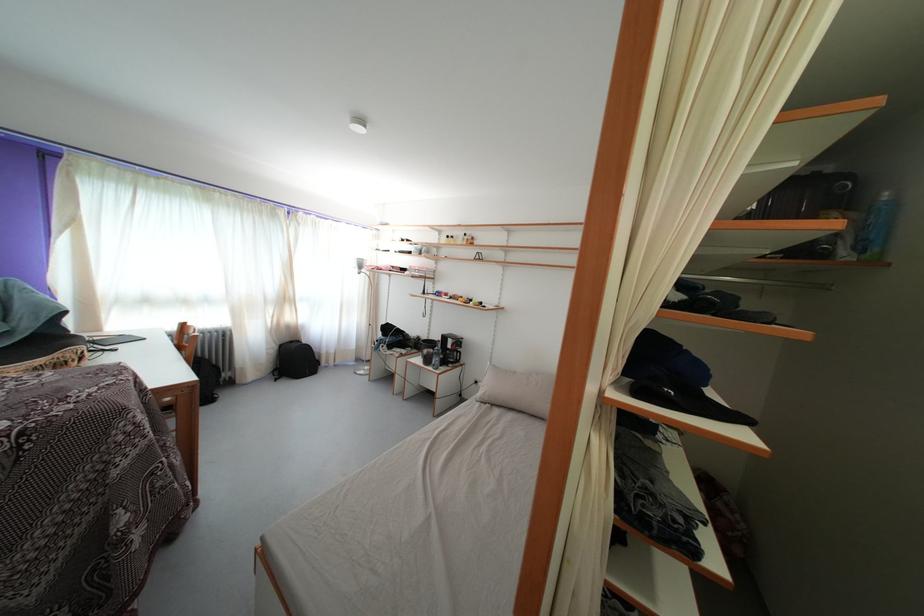
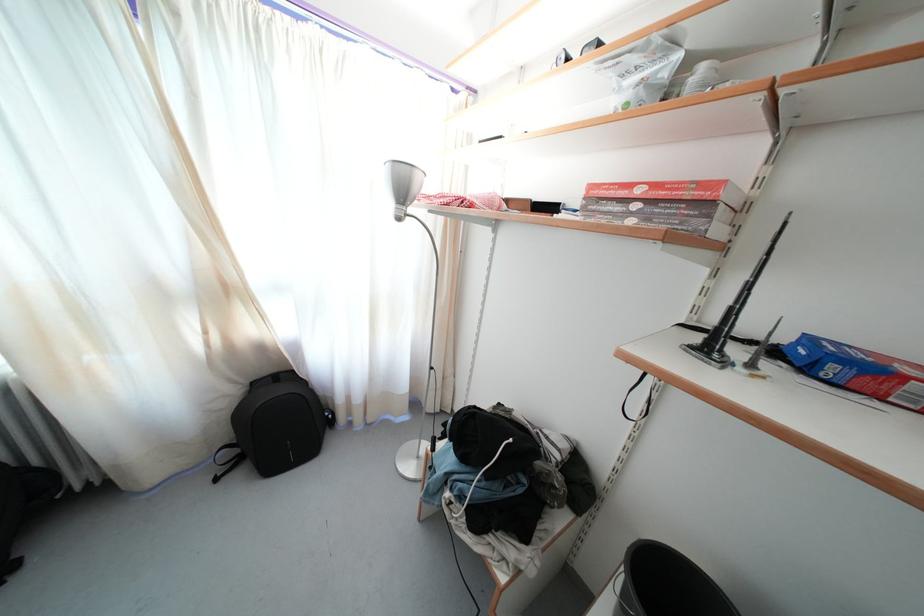
Locate, in the second image, the point that corresponds to pixel 286 352 in the first image.

(259, 390)